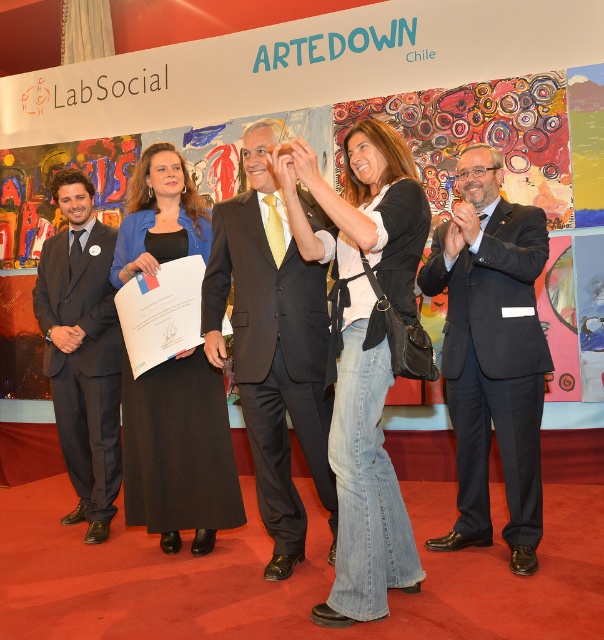
You are a photographer standing in front of the LabSocial event backdrop. You need to take a photo that includes both the black fabric dress at center and the matte black suit at left. Which of these two items is positioned closer to your camera lens?

A: The black fabric dress at center is closer to the viewer than the matte black suit at left, so the black fabric dress at center will appear closer to the camera lens in the photo.

You are a photographer at the event and need to capture a photo where both the jeans at center and the matte black suit at center are visible. Which clothing item should be placed closer to the camera to ensure both are in focus?

The jeans at center has a lesser height compared to matte black suit at center, so placing the jeans at center closer to the camera will ensure both are in focus since they will be at different distances.

You are organizing a photo shoot and need to arrange the dark blue suit at right and the matte black suit at center based on their widths. Which suit should be placed on the left side if you want the wider suit to be on the right?

The matte black suit at center is wider than the dark blue suit at right, so you should place the matte black suit at center on the right side and the dark blue suit at right on the left side.